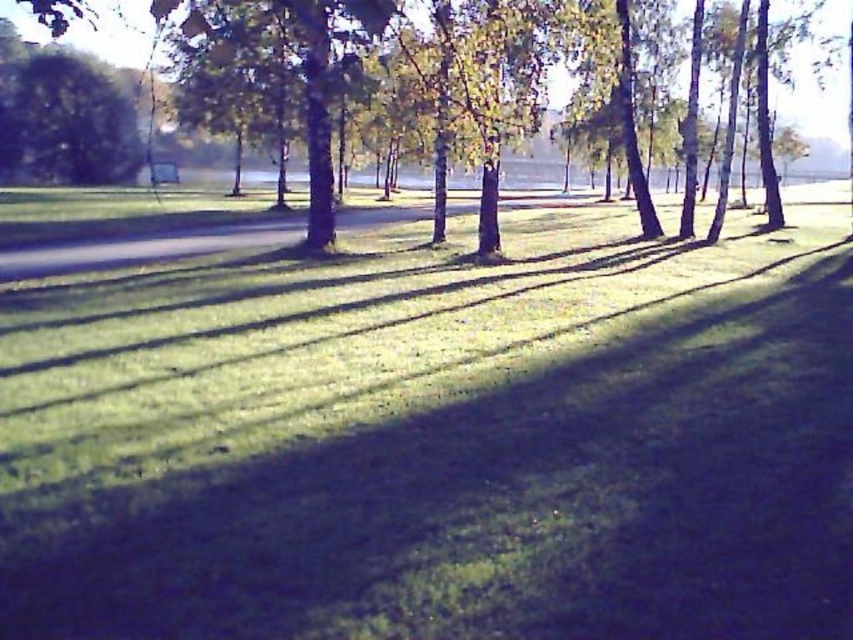
Does green grassy at center have a larger size compared to green leafy tree at center?

Incorrect, green grassy at center is not larger than green leafy tree at center.

Is point (697, 467) closer to viewer compared to point (799, 128)?

That is True.

Is point (77, 330) closer to camera compared to point (136, 10)?

Yes, it is.

Identify the location of green grassy at center. The image size is (853, 640). (438, 440).

Who is lower down, green grassy at center or green leafy tree at upper left?

green grassy at center is lower down.

Is green grassy at center to the left of green leafy tree at upper left from the viewer's perspective?

Incorrect, green grassy at center is not on the left side of green leafy tree at upper left.

Measure the distance between green grassy at center and camera.

green grassy at center and camera are 9.65 feet apart from each other.

I want to click on green grassy at center, so click(x=438, y=440).

Does green leafy tree at upper left appear under green leafy tree at center?

Yes.

Describe the element at coordinates (65, 120) in the screenshot. I see `green leafy tree at upper left` at that location.

Identify the location of green leafy tree at upper left. The height and width of the screenshot is (640, 853). (65, 120).